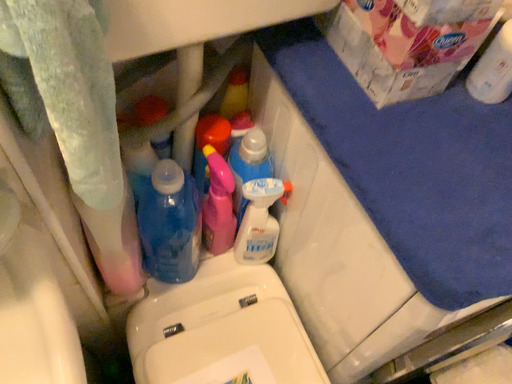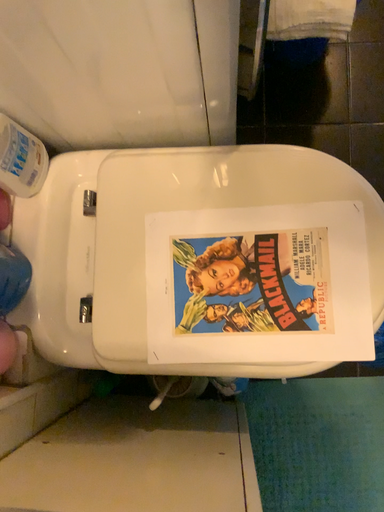
Question: Which way did the camera rotate in the video?

Choices:
 (A) rotated upward
 (B) rotated downward

Answer: (B)